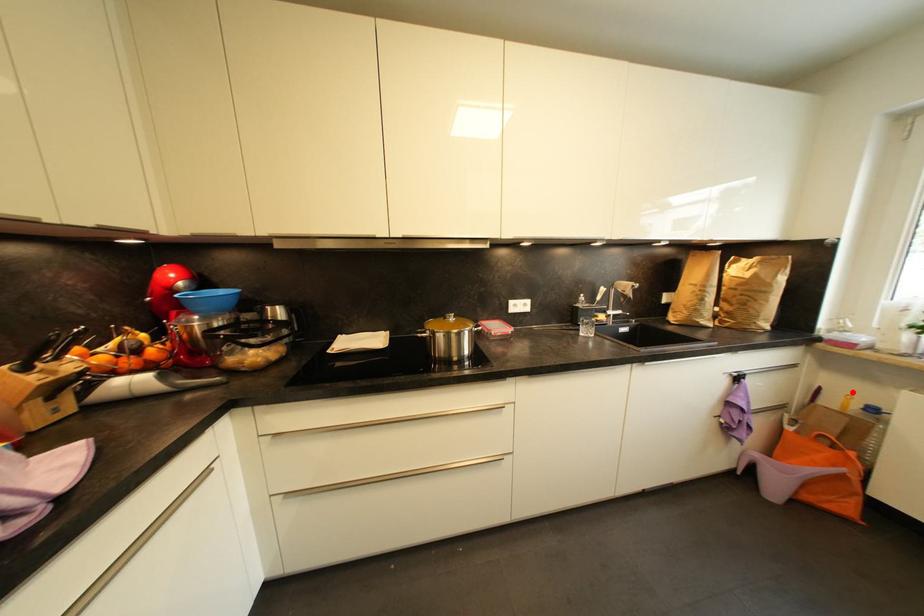
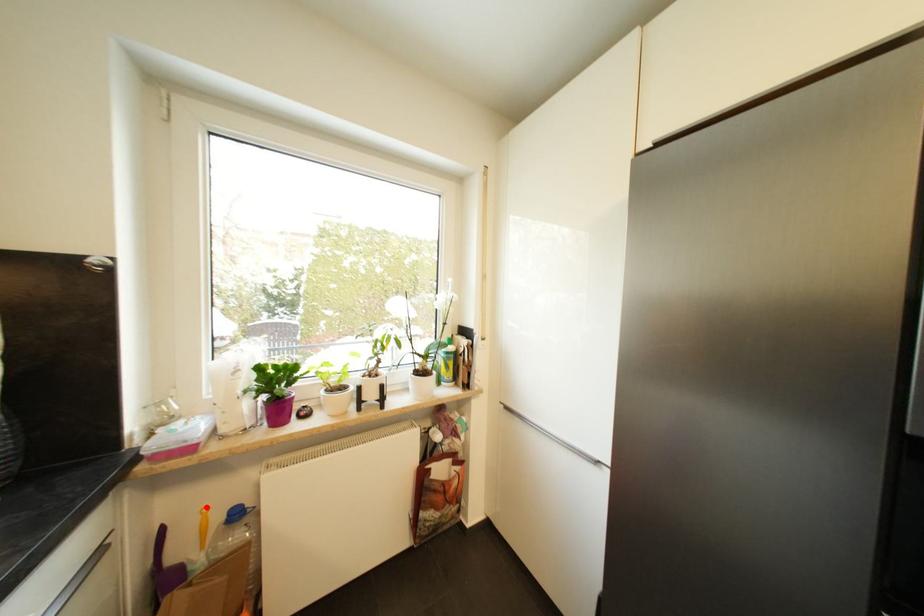
I am providing you with two images of the same scene from different viewpoints. A red point is marked on the first image and another point is marked on the second image. Are the points marked in image1 and image2 representing the same 3D position?

Yes